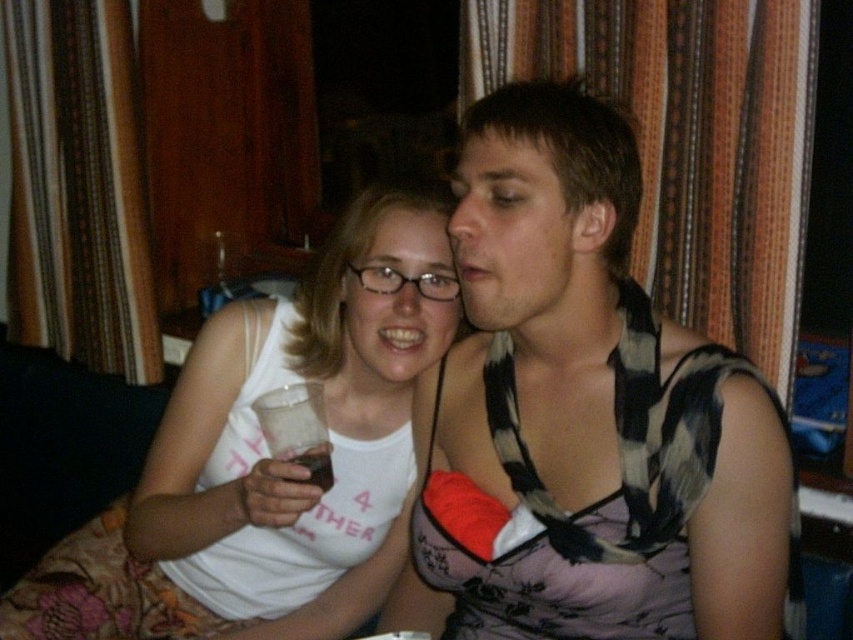
You are a photographer setting up for a portrait. You notice the white matte tank top at center and the translucent plastic cup at lower center in the frame. Which object would you need to adjust your focus settings for if you want to ensure the larger object is in sharp focus?

The white matte tank top at center has a larger size compared to the translucent plastic cup at lower center, so you should adjust your focus settings for the white matte tank top at center to ensure it is in sharp focus.

You are standing in the room and want to place a small decoration between the two points, point (650, 323) and point (397, 252). Which point should the decoration be closer to so it is positioned in front of the other point?

The decoration should be closer to point (650, 323) because it is in front of point (397, 252).

You are a photographer trying to capture a clear shot of both the white matte tank top at center and the translucent plastic cup at lower center. Since the tank top is much taller than the cup, which object will appear larger in the photo?

The white matte tank top at center will appear larger in the photo because it is much taller than the translucent plastic cup at lower center.